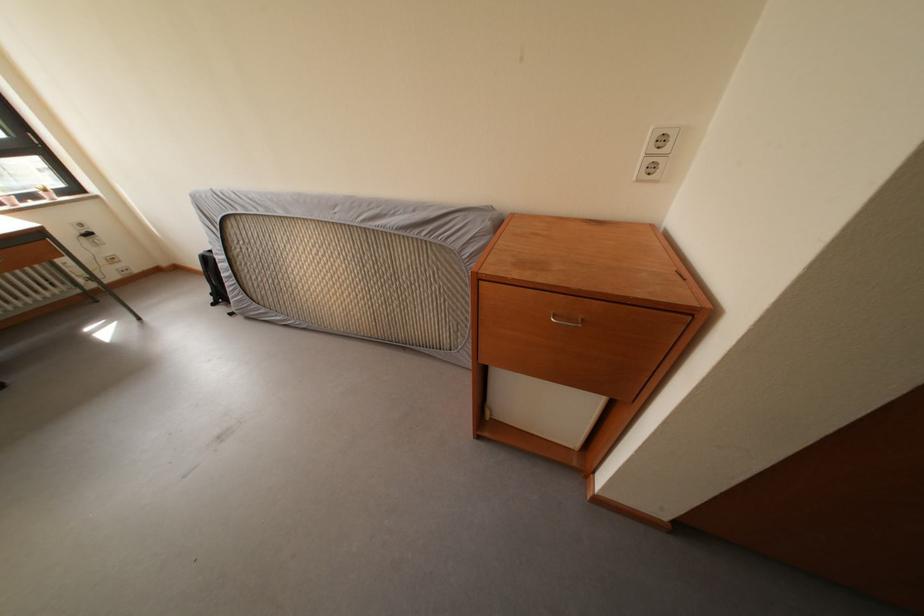
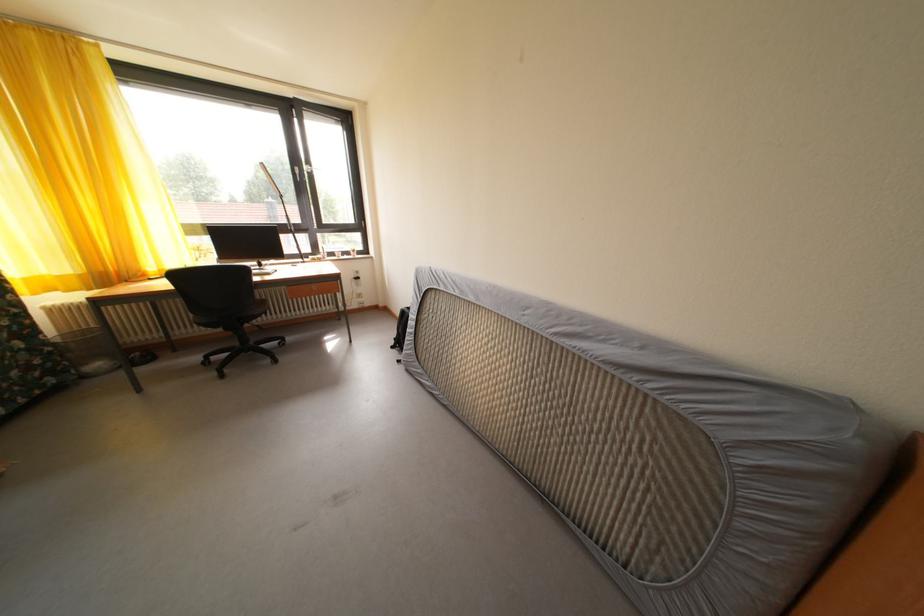
Question: The camera is either moving clockwise (left) or counter-clockwise (right) around the object. The first image is from the beginning of the video and the second image is from the end. Is the camera moving left or right when shooting the video?

Choices:
 (A) Left
 (B) Right

Answer: (B)